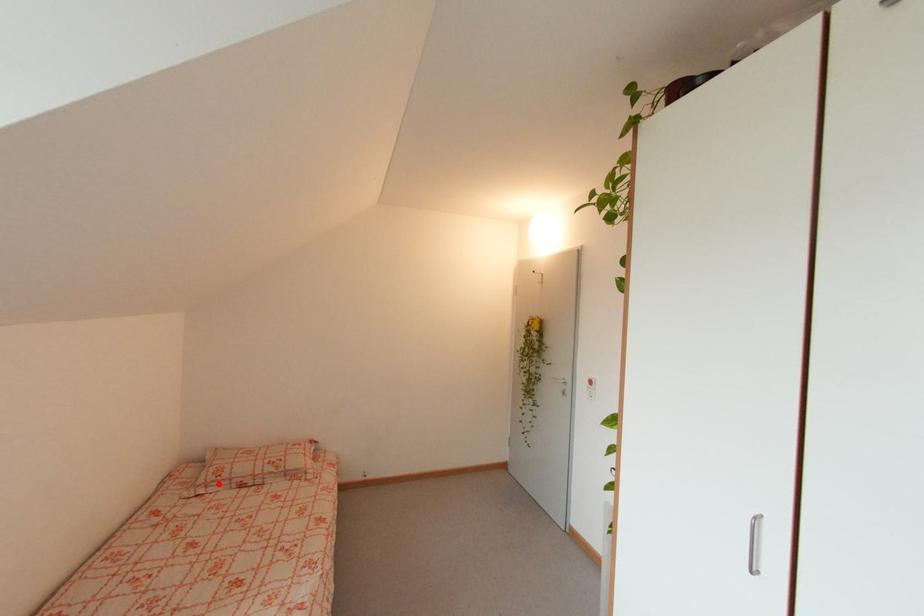
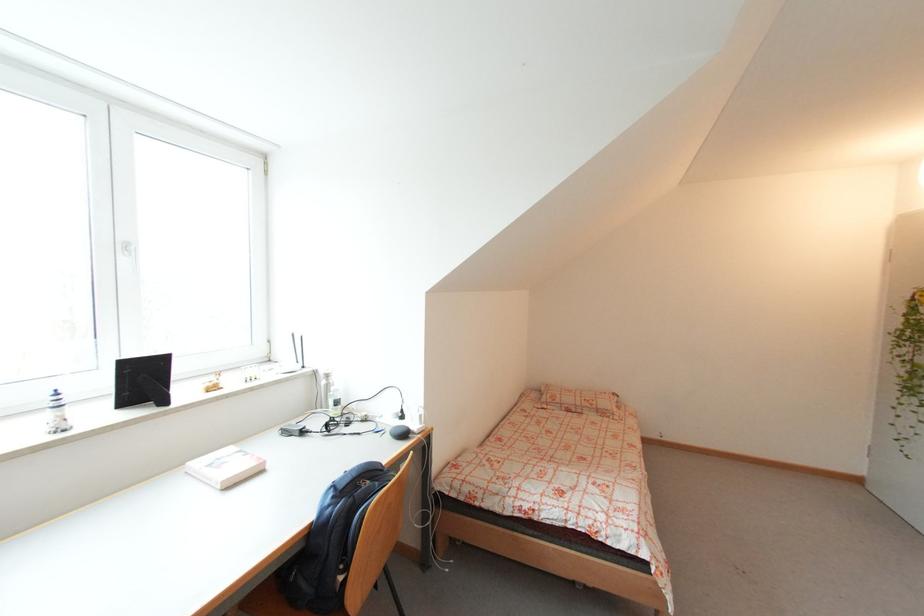
Find the pixel in the second image that matches the highlighted location in the first image.

(555, 405)